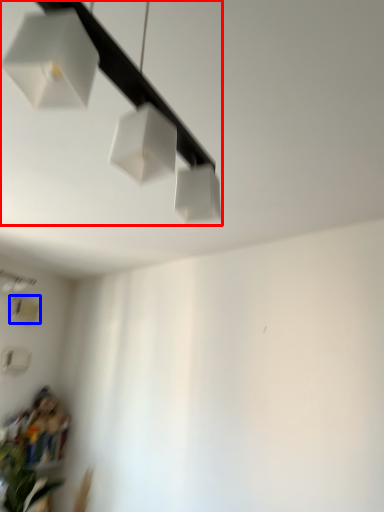
Question: Which object appears farthest to the camera in this image, lamp (highlighted by a red box) or lamp (highlighted by a blue box)?

Choices:
 (A) lamp
 (B) lamp

Answer: (B)